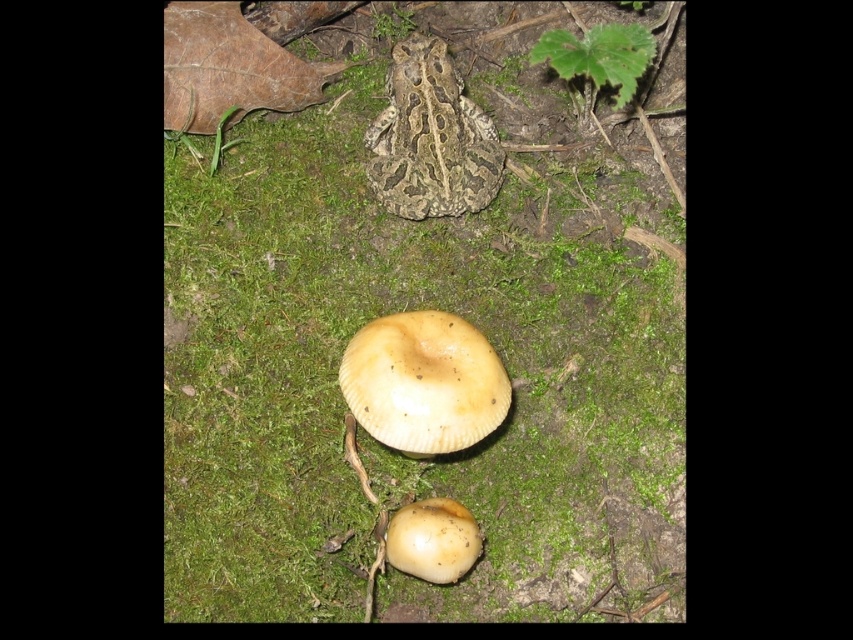
Question: Is camouflage-patterned frog at center to the right of smooth beige mushroom at center from the viewer's perspective?

Choices:
 (A) yes
 (B) no

Answer: (B)

Question: Which point appears closest to the camera in this image?

Choices:
 (A) (381, 408)
 (B) (398, 186)
 (C) (444, 560)

Answer: (C)

Question: Is light brown matte mushroom at center bigger than camouflage-patterned frog at center?

Choices:
 (A) no
 (B) yes

Answer: (B)

Question: Which object is farther from the camera taking this photo?

Choices:
 (A) light brown matte mushroom at center
 (B) smooth beige mushroom at center
 (C) camouflage-patterned frog at center

Answer: (C)

Question: Considering the relative positions of camouflage-patterned frog at center and smooth beige mushroom at center in the image provided, where is camouflage-patterned frog at center located with respect to smooth beige mushroom at center?

Choices:
 (A) left
 (B) right

Answer: (A)

Question: Which object is closer to the camera taking this photo?

Choices:
 (A) light brown matte mushroom at center
 (B) camouflage-patterned frog at center
 (C) smooth beige mushroom at center

Answer: (C)